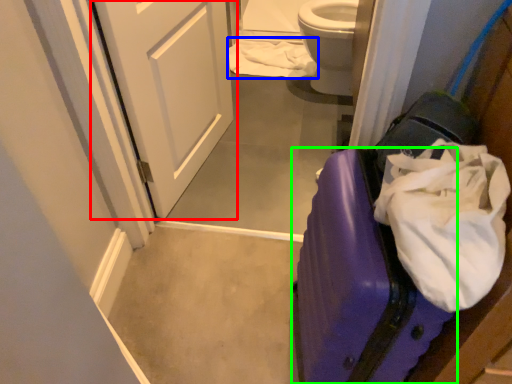
Question: Which object is the closest to the door (highlighted by a red box)? Choose among these: toilet paper (highlighted by a blue box) or suitcase (highlighted by a green box).

Choices:
 (A) toilet paper
 (B) suitcase

Answer: (A)